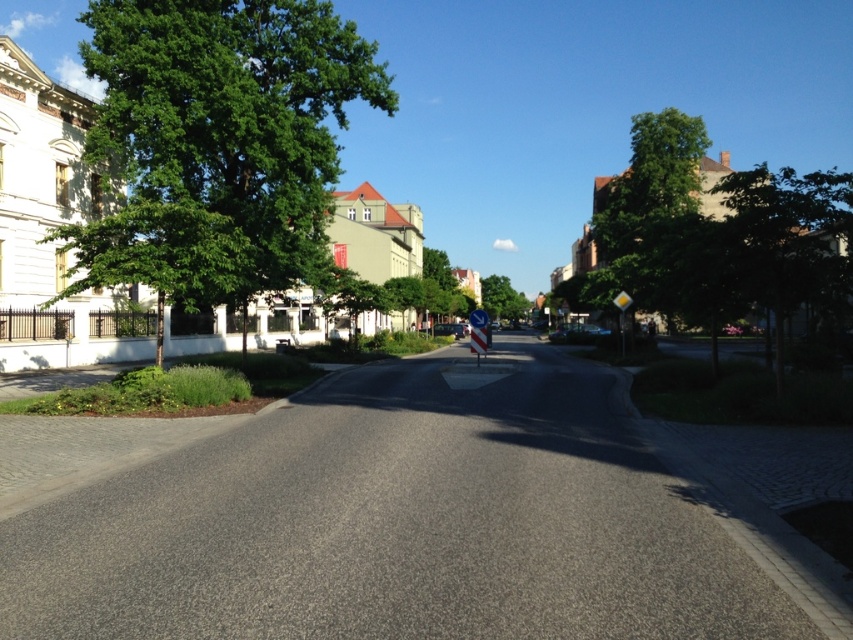
You are a city planner assessing the urban greenery. You notice the green leafy tree at left and the green leafy tree at center. Which tree is taller?

The green leafy tree at center is taller than the green leafy tree at left.